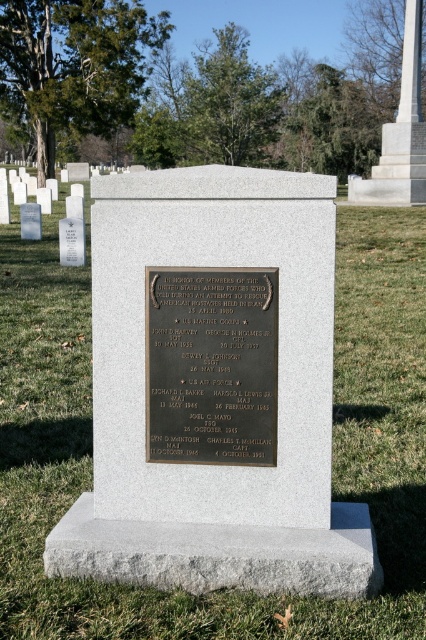
Question: Which point is farther to the camera?

Choices:
 (A) (333, 275)
 (B) (201, 435)
 (C) (416, 76)

Answer: (C)

Question: Is gray granite gravestone at center to the left of bronze plaque at center from the viewer's perspective?

Choices:
 (A) yes
 (B) no

Answer: (B)

Question: Which object is positioned closest to the white marble monument at upper right?

Choices:
 (A) gray granite gravestone at center
 (B) bronze plaque at center

Answer: (B)

Question: Which point appears closest to the camera in this image?

Choices:
 (A) (218, 360)
 (B) (94, 369)

Answer: (A)

Question: Does bronze plaque at center have a larger size compared to white marble monument at upper right?

Choices:
 (A) no
 (B) yes

Answer: (A)

Question: Does gray granite gravestone at center lie in front of white marble monument at upper right?

Choices:
 (A) no
 (B) yes

Answer: (B)